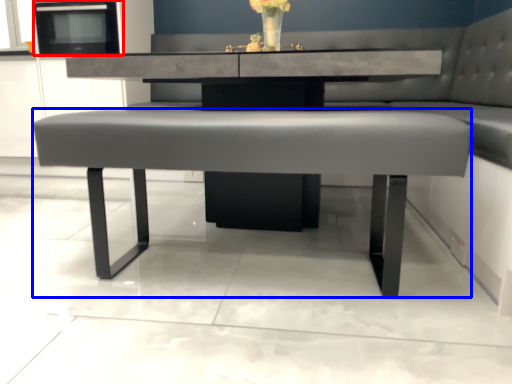
Question: Which object appears closest to the camera in this image, appliance (highlighted by a red box) or coffee table (highlighted by a blue box)?

Choices:
 (A) appliance
 (B) coffee table

Answer: (B)